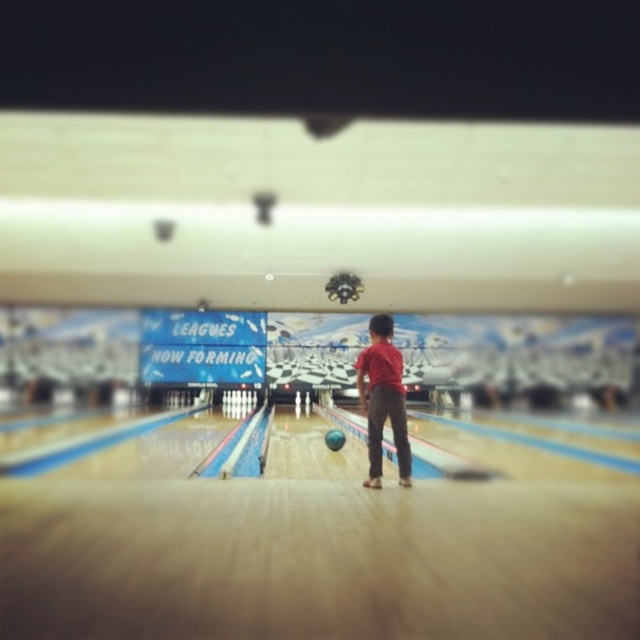
Can you confirm if red matte shirt at center is positioned to the right of shiny blue bowling ball at center?

Correct, you'll find red matte shirt at center to the right of shiny blue bowling ball at center.

Locate an element on the screen. This screenshot has height=640, width=640. red matte shirt at center is located at coordinates (381, 397).

Measure the distance between point (380,397) and camera.

Point (380,397) is 17.90 feet away from camera.

Locate an element on the screen. red matte shirt at center is located at coordinates coord(381,397).